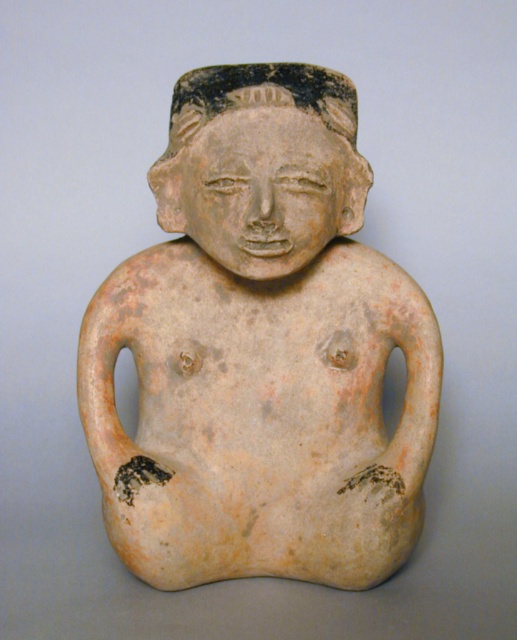
Does matte clay figure at center appear over matte clay head at center?

No.

Is matte clay figure at center smaller than matte clay head at center?

Incorrect, matte clay figure at center is not smaller in size than matte clay head at center.

Who is more forward, (265,422) or (293,124)?

Point (293,124) is in front.

Identify the location of matte clay figure at center. This screenshot has height=640, width=517. (261, 349).